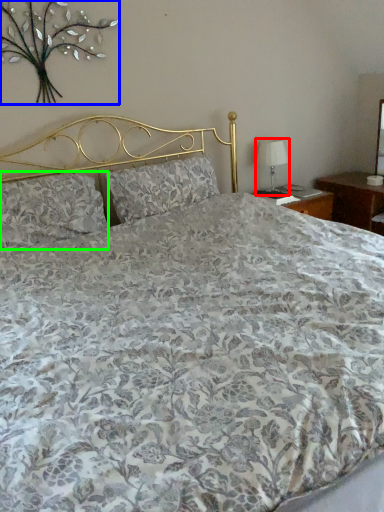
Question: Which is nearer to the table lamp (highlighted by a red box)? floral arrangement (highlighted by a blue box) or pillow (highlighted by a green box).

Choices:
 (A) floral arrangement
 (B) pillow

Answer: (A)